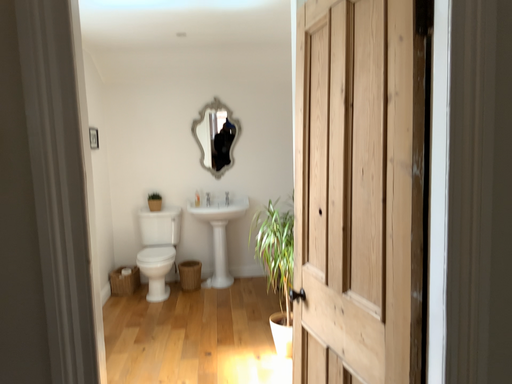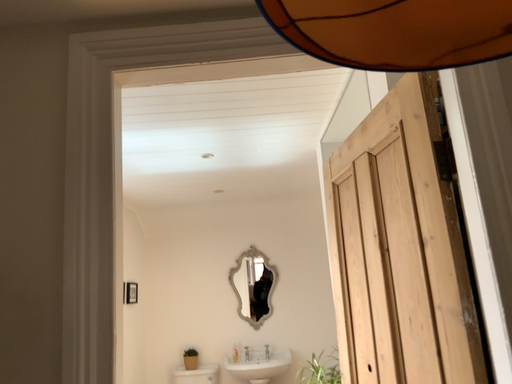
Question: Which way did the camera rotate in the video?

Choices:
 (A) rotated downward
 (B) rotated upward

Answer: (B)